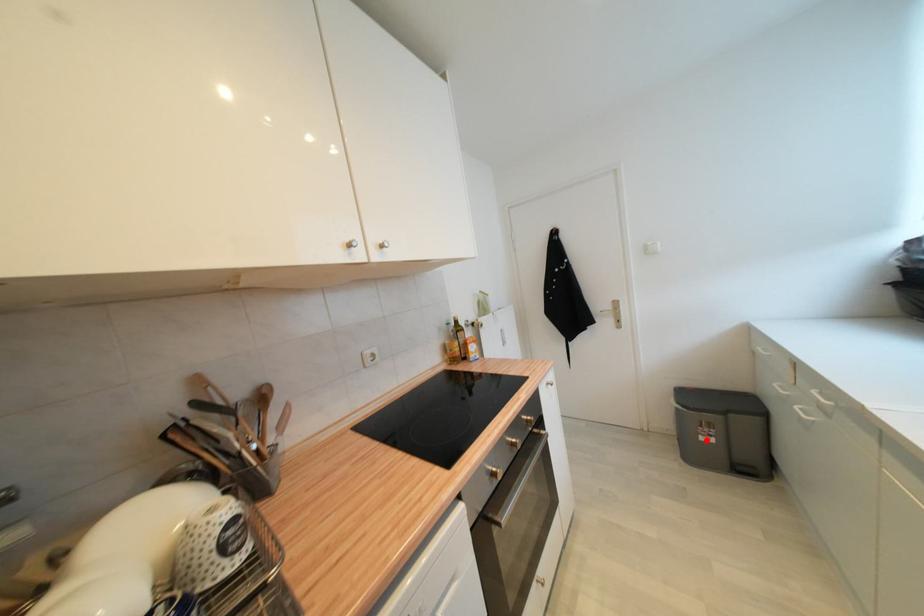
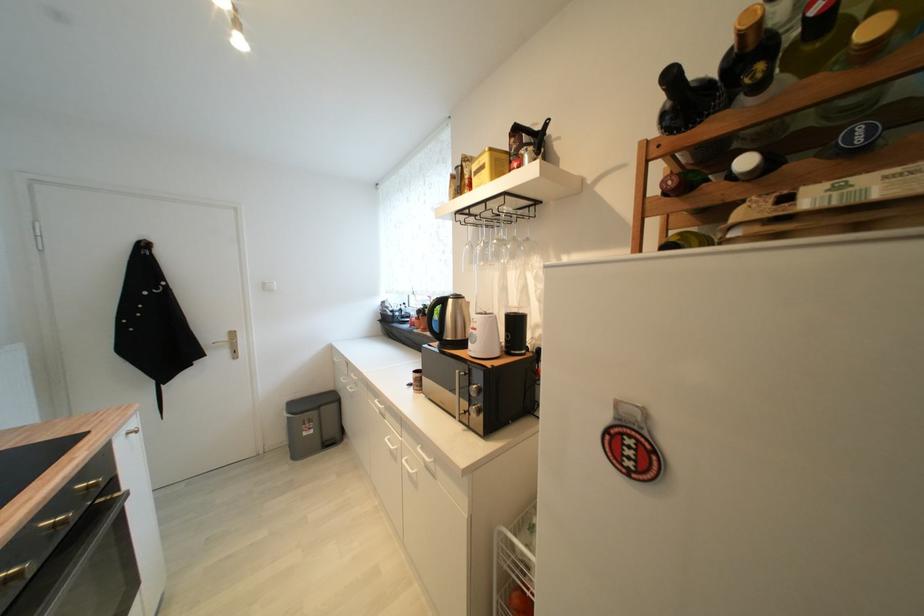
In the second image, find the point that corresponds to the highlighted location in the first image.

(310, 436)